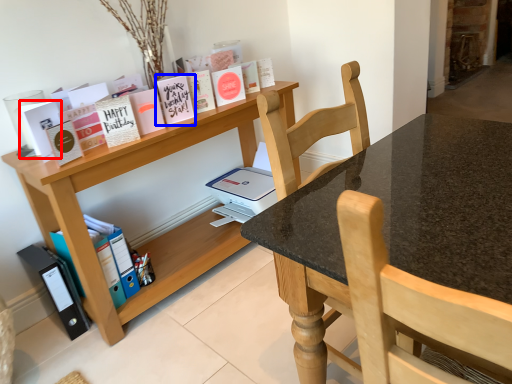
Question: Which object appears farthest to the camera in this image, paperback book (highlighted by a red box) or paperback book (highlighted by a blue box)?

Choices:
 (A) paperback book
 (B) paperback book

Answer: (B)